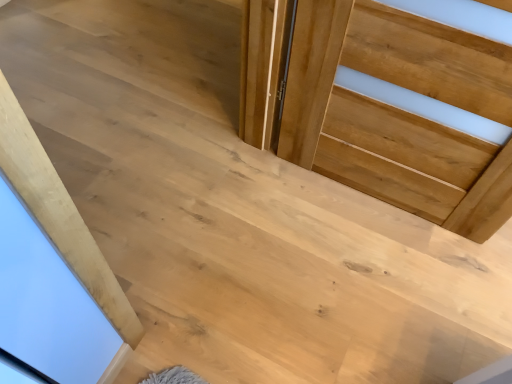
Where is `vacant area in front of natural wood chest of drawers at right`? The image size is (512, 384). vacant area in front of natural wood chest of drawers at right is located at coordinates (370, 287).